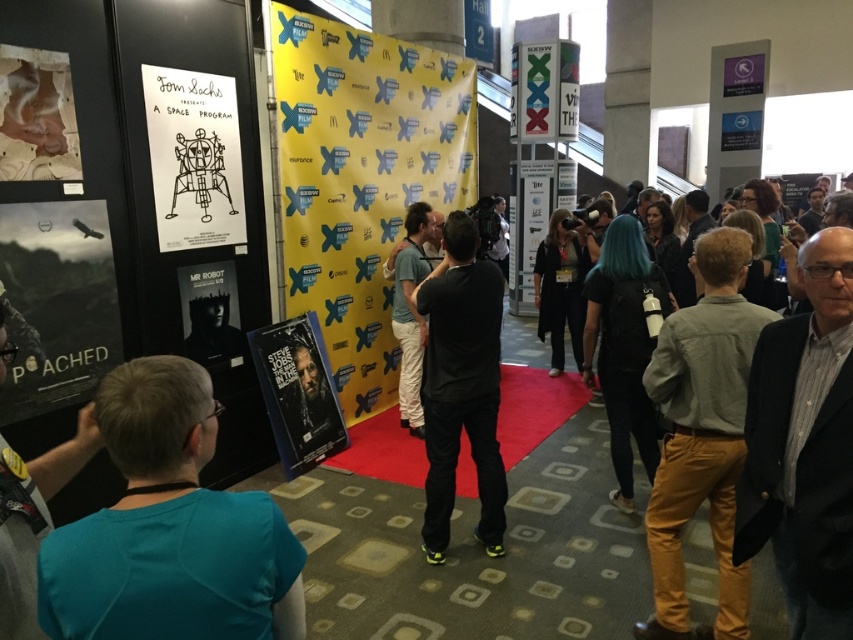
Can you confirm if teal shirt at left is positioned to the left of white paper poster at left?

Incorrect, teal shirt at left is not on the left side of white paper poster at left.

Between teal shirt at left and white paper poster at left, which one is positioned lower?

teal shirt at left is lower down.

Where is `teal shirt at left`? Image resolution: width=853 pixels, height=640 pixels. teal shirt at left is located at coordinates (169, 529).

This screenshot has width=853, height=640. Identify the location of teal shirt at left. (169, 529).

Based on the photo, between shiny black jacket at center and blue shirt at lower left, which one has more height?

With more height is shiny black jacket at center.

How much distance is there between shiny black jacket at center and blue shirt at lower left?

shiny black jacket at center and blue shirt at lower left are 2.65 meters apart.

Between point (641, 339) and point (18, 592), which one is positioned behind?

The point (641, 339) is behind.

You are a GUI agent. You are given a task and a screenshot of the screen. Output one action in this format:
    pyautogui.click(x=<x>, y=<y>)
    Task: Click on the shiny black jacket at center
    The image size is (853, 640).
    Given the screenshot: What is the action you would take?
    pyautogui.click(x=624, y=346)

Can you confirm if dark gray suit jacket at center right is positioned to the right of blue shirt at lower left?

Yes, dark gray suit jacket at center right is to the right of blue shirt at lower left.

Between dark gray suit jacket at center right and blue shirt at lower left, which one has more height?

With more height is dark gray suit jacket at center right.

Image resolution: width=853 pixels, height=640 pixels. In order to click on dark gray suit jacket at center right in this screenshot , I will do `click(804, 445)`.

This screenshot has width=853, height=640. I want to click on dark gray suit jacket at center right, so click(x=804, y=445).